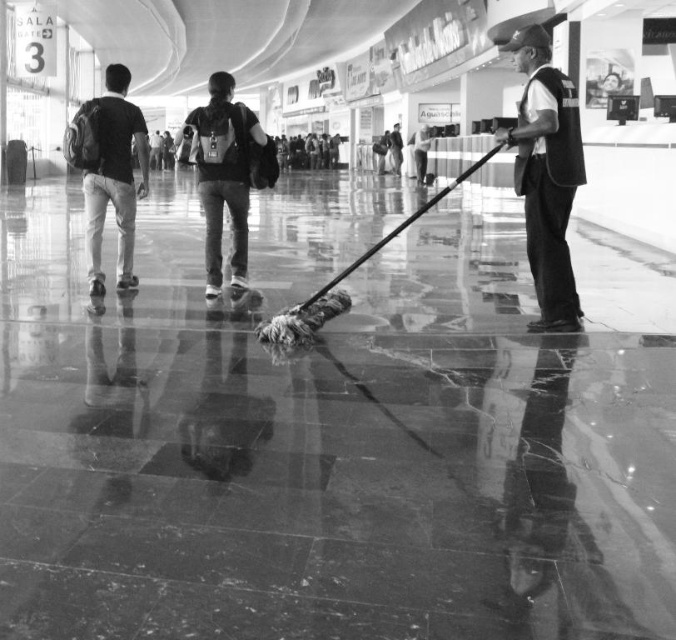
You are a visitor in this space and want to locate the dark gray uniform at right and the matte black backpack at center. Which object is taller?

The dark gray uniform at right is much taller than the matte black backpack at center.

You are standing in the convention center and see the dark gray uniform at right and the matte black backpack at left. Which object is closer to the floor?

The dark gray uniform at right is located below matte black backpack at left, so it is closer to the floor.